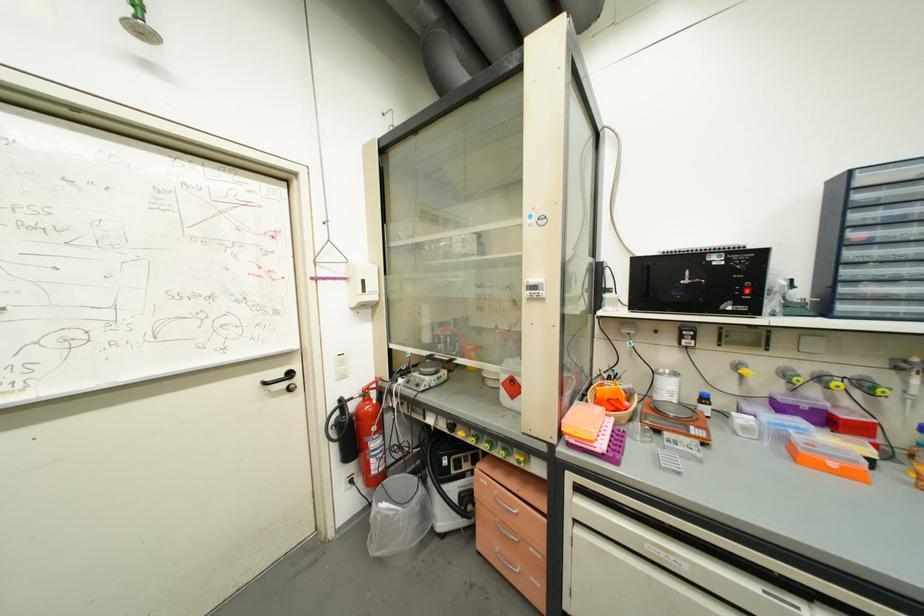
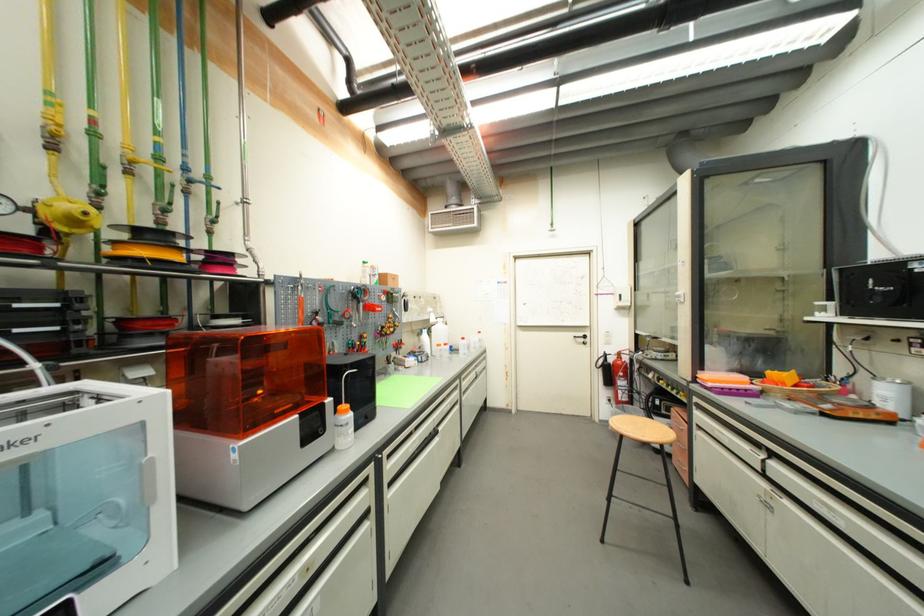
Locate, in the second image, the point that corresponds to (271,386) in the first image.

(580, 339)